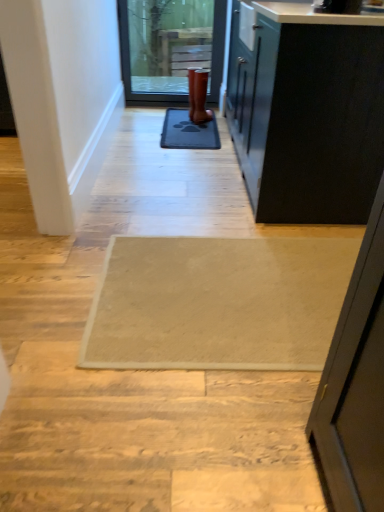
Question: From a real-world perspective, is matte glass door at upper center physically located above or below black rubber mat at center?

Choices:
 (A) above
 (B) below

Answer: (A)

Question: Is matte glass door at upper center taller or shorter than black rubber mat at center?

Choices:
 (A) tall
 (B) short

Answer: (A)

Question: Which of these objects is positioned farthest from the matte glass door at upper center?

Choices:
 (A) black rubber mat at center
 (B) beige textured rug at center
 (C) rubber boot at center
 (D) white smooth door at left

Answer: (B)

Question: Estimate the real-world distances between objects in this image. Which object is farther from the rubber boot at center?

Choices:
 (A) black rubber mat at center
 (B) beige textured rug at center
 (C) white smooth door at left
 (D) matte glass door at upper center

Answer: (B)